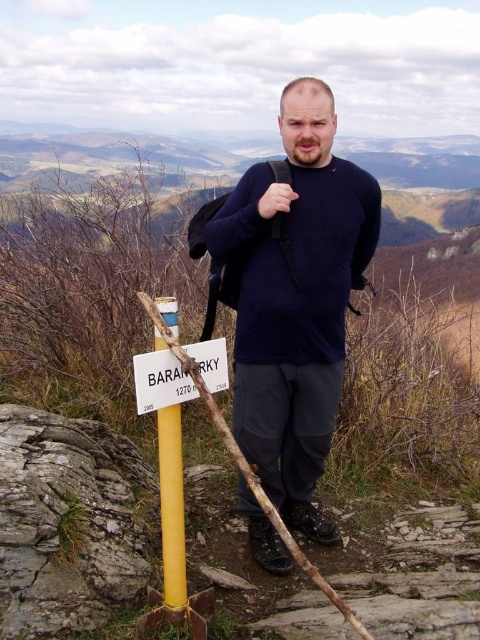
Can you confirm if yellow metal post at left is thinner than yellow plastic post at center?

No, yellow metal post at left is not thinner than yellow plastic post at center.

The width and height of the screenshot is (480, 640). What are the coordinates of `yellow metal post at left` in the screenshot? It's located at (173, 540).

Does yellow plastic post at center lie behind white plastic sign at lower center?

Yes, it is behind white plastic sign at lower center.

Consider the image. Who is taller, yellow plastic post at center or white plastic sign at lower center?

yellow plastic post at center is taller.

Image resolution: width=480 pixels, height=640 pixels. I want to click on yellow plastic post at center, so click(171, 506).

Does yellow metal post at left lie in front of white plastic sign at lower center?

No, yellow metal post at left is further to the viewer.

Can you confirm if yellow metal post at left is wider than white plastic sign at lower center?

Yes.

The image size is (480, 640). Find the location of `yellow metal post at left`. yellow metal post at left is located at coordinates 173,540.